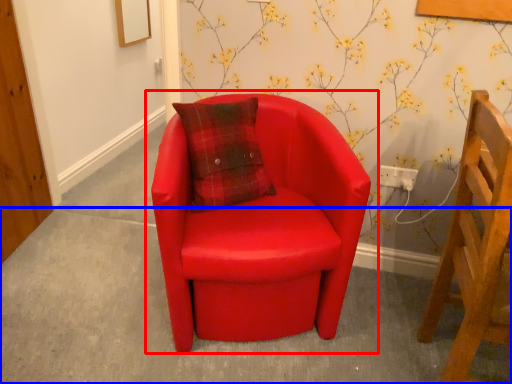
Question: Which object is closer to the camera taking this photo, chair (highlighted by a red box) or concrete (highlighted by a blue box)?

Choices:
 (A) chair
 (B) concrete

Answer: (A)